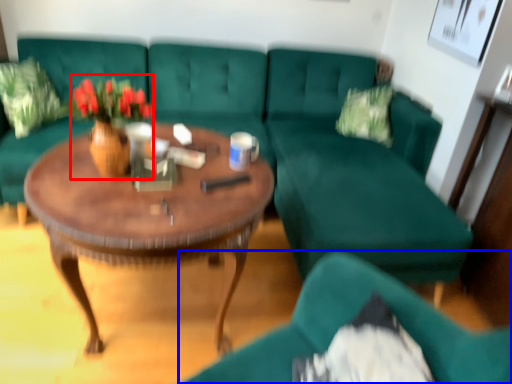
Question: Which object is further to the camera taking this photo, floral arrangement (highlighted by a red box) or chair (highlighted by a blue box)?

Choices:
 (A) floral arrangement
 (B) chair

Answer: (A)